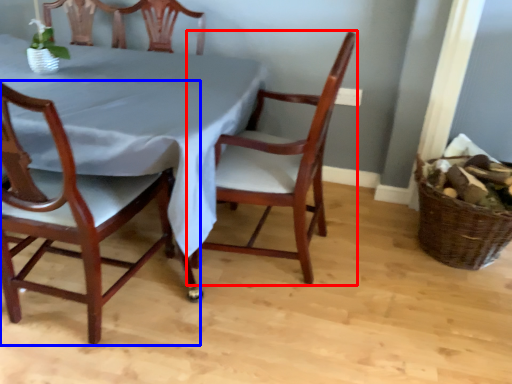
Question: Among these objects, which one is nearest to the camera, chair (highlighted by a red box) or chair (highlighted by a blue box)?

Choices:
 (A) chair
 (B) chair

Answer: (B)